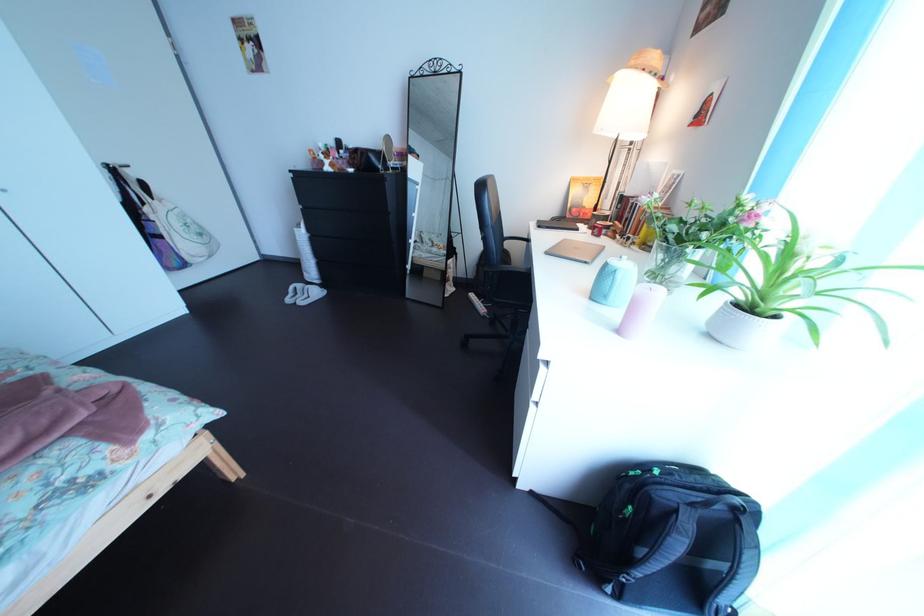
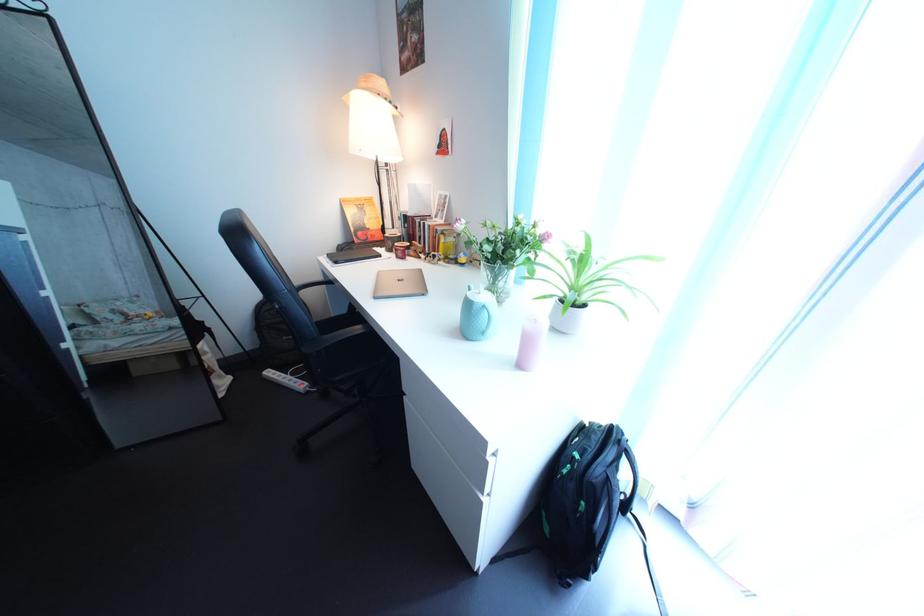
Question: How did the camera likely rotate?

Choices:
 (A) Left
 (B) Right
 (C) Up
 (D) Down

Answer: (B)